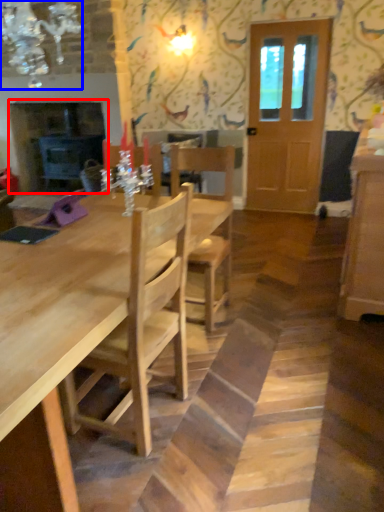
Question: Among these objects, which one is farthest to the camera, fireplace (highlighted by a red box) or light fixture (highlighted by a blue box)?

Choices:
 (A) fireplace
 (B) light fixture

Answer: (A)